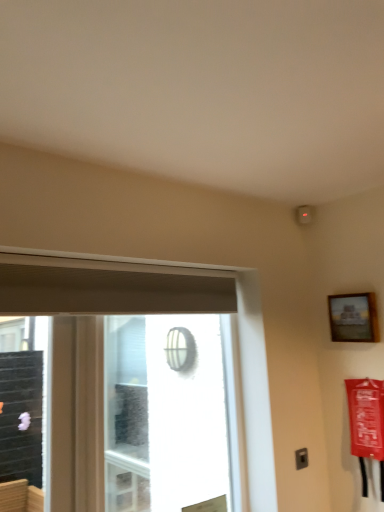
Find the location of a particular element. The width and height of the screenshot is (384, 512). white mesh screen at center is located at coordinates (164, 413).

The width and height of the screenshot is (384, 512). Describe the element at coordinates (353, 318) in the screenshot. I see `wooden frame at upper right` at that location.

Locate an element on the screen. This screenshot has width=384, height=512. transparent glass window at center is located at coordinates (158, 312).

Considering the sizes of objects transparent glass window at center and white mesh screen at center in the image provided, who is wider, transparent glass window at center or white mesh screen at center?

white mesh screen at center is wider.

From a real-world perspective, is transparent glass window at center above or below white mesh screen at center?

In terms of real-world spatial position, transparent glass window at center is below white mesh screen at center.

Which is in front, point (245, 367) or point (195, 337)?

The point (245, 367) is closer.

How much distance is there between transparent glass window at center and white mesh screen at center?

transparent glass window at center and white mesh screen at center are 70.49 centimeters apart.

Image resolution: width=384 pixels, height=512 pixels. In order to click on window screen in front of the wooden frame at upper right in this screenshot , I will do `click(164, 413)`.

Could you tell me if wooden frame at upper right is turned towards white mesh screen at center?

No.

From the image's perspective, which is above, wooden frame at upper right or white mesh screen at center?

From the image's view, wooden frame at upper right is above.

How many degrees apart are the facing directions of wooden frame at upper right and white mesh screen at center?

The angular difference between wooden frame at upper right and white mesh screen at center is 90.7 degrees.

Considering the relative sizes of white mesh screen at center and transparent glass window at center in the image provided, is white mesh screen at center thinner than transparent glass window at center?

No.

From a real-world perspective, which object rests below the other?

transparent glass window at center.

Visually, is white mesh screen at center positioned to the left or to the right of transparent glass window at center?

Based on their positions, white mesh screen at center is located to the right of transparent glass window at center.

Which is farther from the camera, (208, 413) or (269, 453)?

The point (208, 413) is more distant.

Who is more distant, wooden frame at upper right or transparent glass window at center?

wooden frame at upper right.

Considering the relative positions of wooden frame at upper right and transparent glass window at center in the image provided, is wooden frame at upper right to the left of transparent glass window at center from the viewer's perspective?

No, wooden frame at upper right is not to the left of transparent glass window at center.

From the image's perspective, who appears lower, wooden frame at upper right or transparent glass window at center?

transparent glass window at center.

Is the position of transparent glass window at center less distant than that of wooden frame at upper right?

Yes, transparent glass window at center is in front of wooden frame at upper right.

Is transparent glass window at center oriented towards wooden frame at upper right?

No, transparent glass window at center does not turn towards wooden frame at upper right.

Can you confirm if transparent glass window at center is bigger than wooden frame at upper right?

Correct, transparent glass window at center is larger in size than wooden frame at upper right.

From the picture: Can you confirm if transparent glass window at center is thinner than wooden frame at upper right?

Incorrect, the width of transparent glass window at center is not less than that of wooden frame at upper right.

Which object is more forward, white mesh screen at center or wooden frame at upper right?

white mesh screen at center is in front.

From a real-world perspective, is white mesh screen at center positioned above or below wooden frame at upper right?

From a real-world perspective, white mesh screen at center is physically below wooden frame at upper right.

Is white mesh screen at center facing towards wooden frame at upper right?

No, white mesh screen at center is not oriented towards wooden frame at upper right.

Considering the points (158, 406) and (331, 332), which point is in front, point (158, 406) or point (331, 332)?

The point (331, 332) is more forward.

In order to click on window in front of the white mesh screen at center in this screenshot , I will do `click(158, 312)`.

Locate an element on the screen. Image resolution: width=384 pixels, height=512 pixels. picture frame to the right of white mesh screen at center is located at coordinates (353, 318).

From the image, which object appears to be farther from white mesh screen at center, transparent glass window at center or wooden frame at upper right?

wooden frame at upper right lies further to white mesh screen at center than the other object.

From the image, which object appears to be farther from white mesh screen at center, wooden frame at upper right or transparent glass window at center?

Based on the image, wooden frame at upper right appears to be further to white mesh screen at center.

Considering their positions, is transparent glass window at center positioned further to wooden frame at upper right than white mesh screen at center?

white mesh screen at center lies further to wooden frame at upper right than the other object.

From the image, which object appears to be farther from transparent glass window at center, wooden frame at upper right or white mesh screen at center?

white mesh screen at center is positioned further to the anchor transparent glass window at center.

When comparing their distances from wooden frame at upper right, does white mesh screen at center or transparent glass window at center seem closer?

The object closer to wooden frame at upper right is transparent glass window at center.

Looking at the image, which one is located closer to transparent glass window at center, white mesh screen at center or wooden frame at upper right?

wooden frame at upper right is positioned closer to the anchor transparent glass window at center.

The image size is (384, 512). In order to click on window screen between transparent glass window at center and wooden frame at upper right from left to right in this screenshot , I will do `click(164, 413)`.